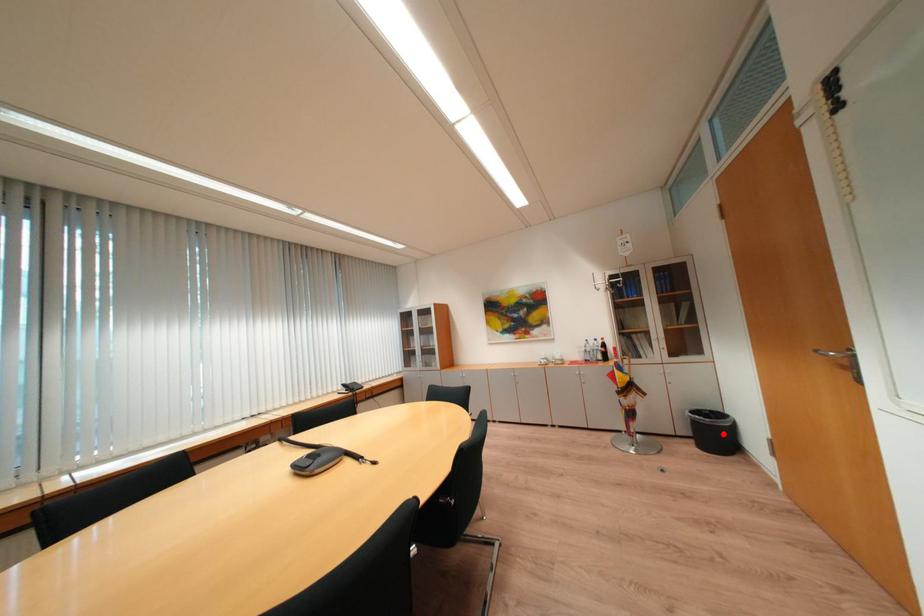
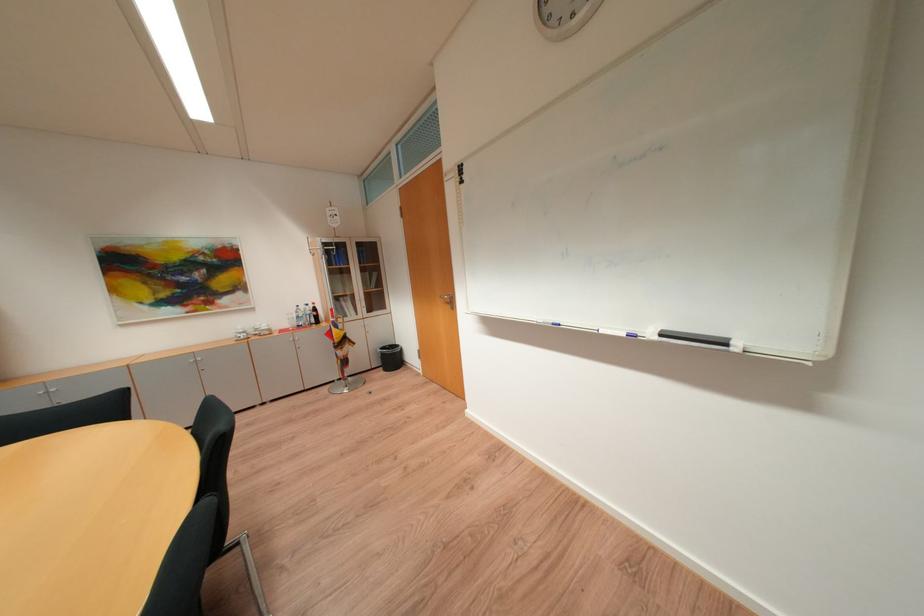
Question: I am providing you with two images of the same scene from different viewpoints. A red point is marked on the first image. Can you still see the location of the red point in image 2?

Choices:
 (A) Yes
 (B) No

Answer: (A)